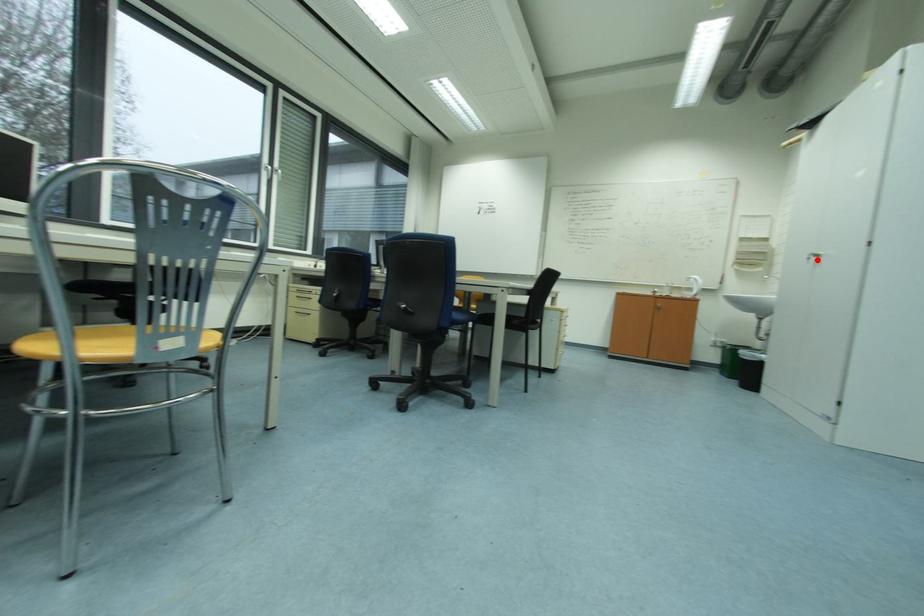
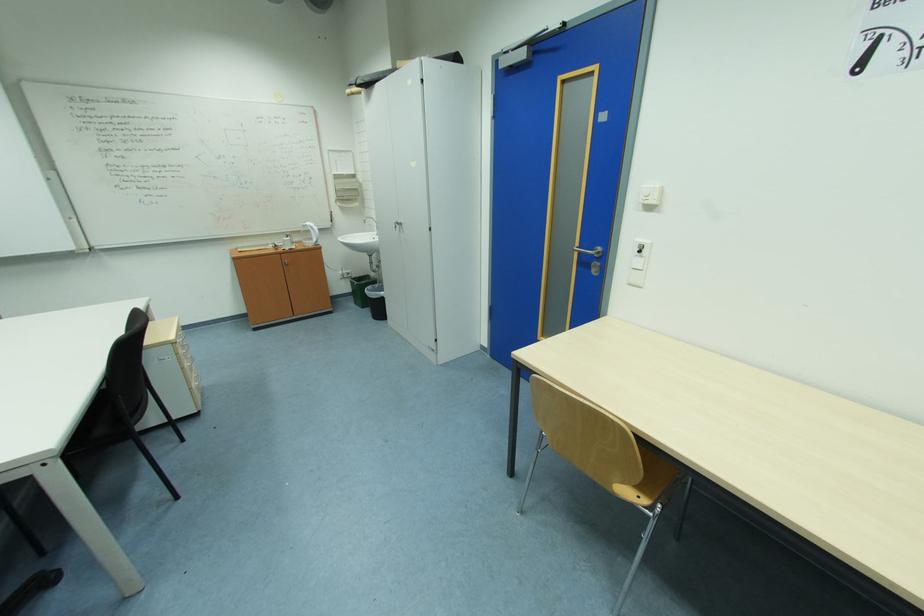
The point at the highlighted location is marked in the first image. Where is the corresponding point in the second image?

(403, 228)